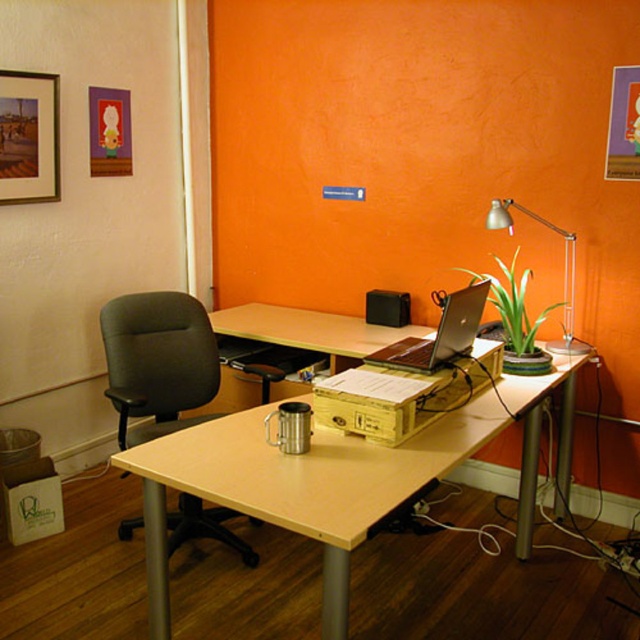
Between matte black laptop at center and metallic silver desk lamp at upper right, which one has more height?

With more height is metallic silver desk lamp at upper right.

Is point (481, 307) farther from viewer compared to point (516, 209)?

No, (481, 307) is closer to viewer.

Where is `matte black laptop at center`? matte black laptop at center is located at coordinates (440, 332).

The image size is (640, 640). What are the coordinates of `light wood/wooden desk at center` in the screenshot? It's located at (337, 477).

You are a GUI agent. You are given a task and a screenshot of the screen. Output one action in this format:
    pyautogui.click(x=<x>, y=<y>)
    Task: Click on the light wood/wooden desk at center
    Image resolution: width=640 pixels, height=640 pixels.
    Given the screenshot: What is the action you would take?
    pyautogui.click(x=337, y=477)

Between light wood/wooden desk at center and wooden framed picture at upper left, which one is positioned higher?

wooden framed picture at upper left is higher up.

Is light wood/wooden desk at center positioned before wooden framed picture at upper left?

Yes, it is in front of wooden framed picture at upper left.

Which is in front, point (150, 584) or point (28, 176)?

Point (150, 584) is more forward.

What are the coordinates of `light wood/wooden desk at center` in the screenshot? It's located at (337, 477).